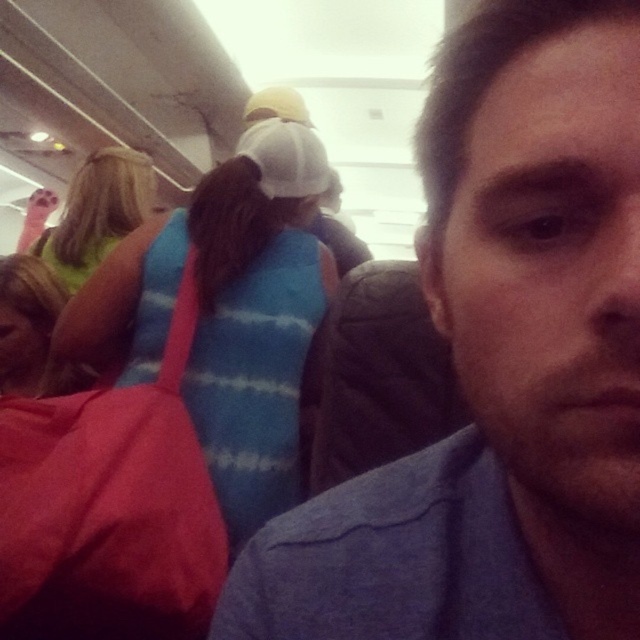
Looking at this image, you are a passenger on a bus and see the blue cotton shirt at center and the blue striped sweater at upper center. Which one is closer to the front of the bus?

The blue cotton shirt at center is positioned under the blue striped sweater at upper center, meaning the blue cotton shirt at center is closer to the front of the bus.